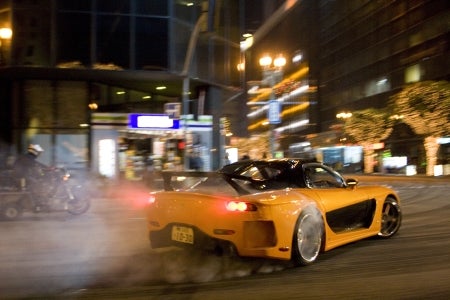
The width and height of the screenshot is (450, 300). What are the coordinates of `right door` in the screenshot? It's located at (334, 196).